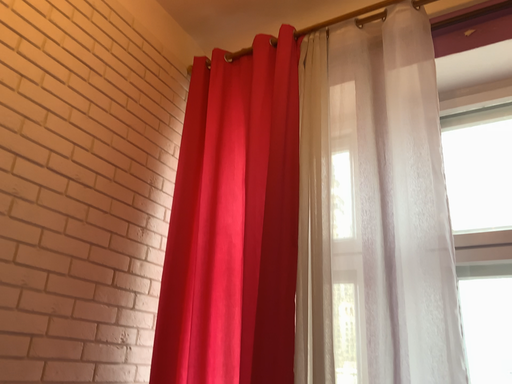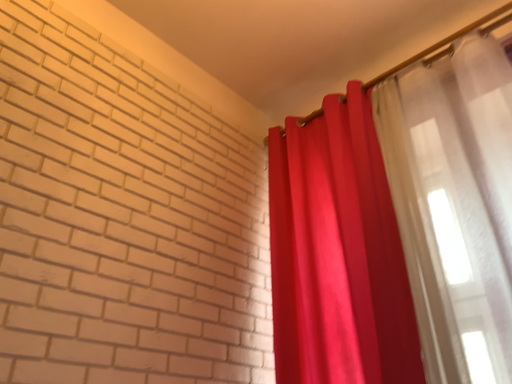
Question: How did the camera likely rotate when shooting the video?

Choices:
 (A) rotated downward
 (B) rotated upward

Answer: (B)